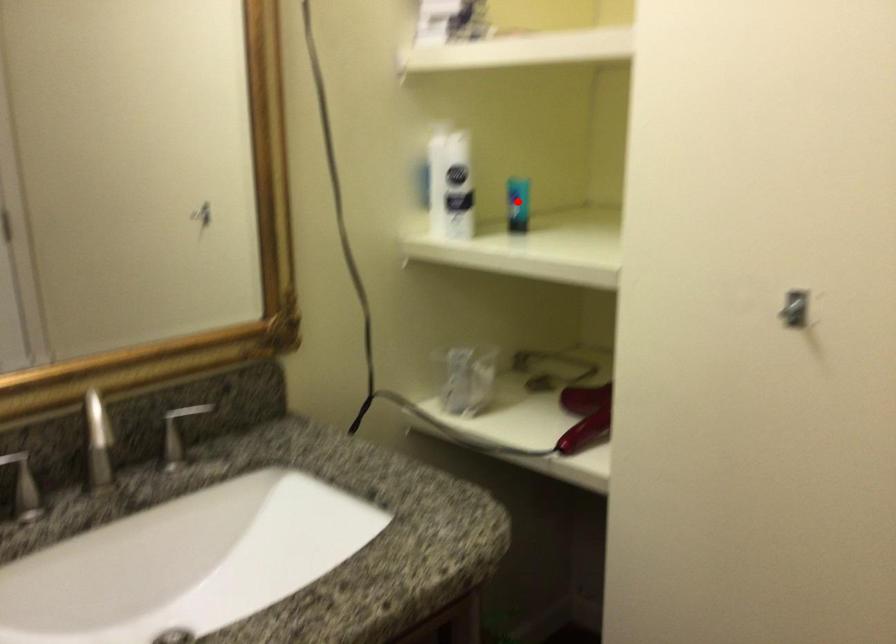
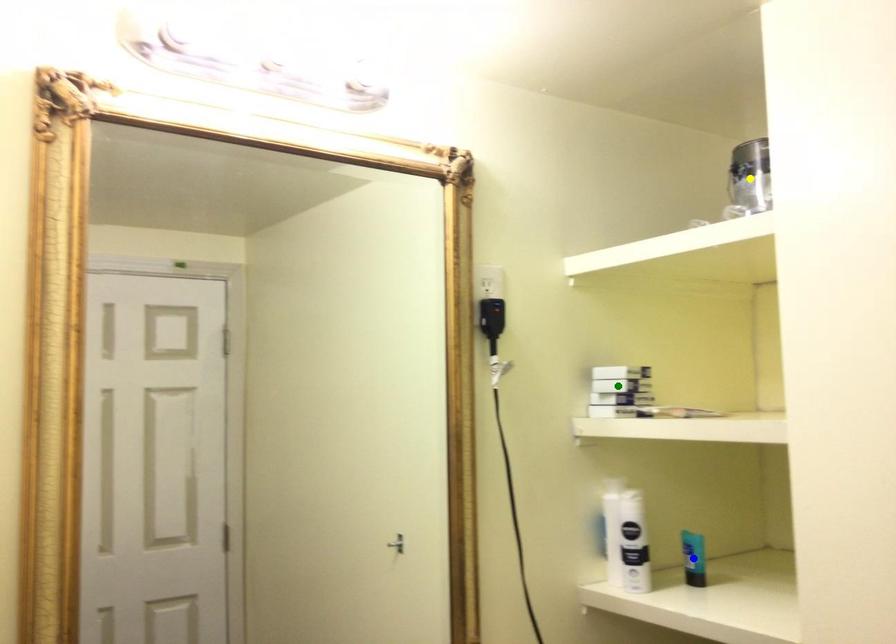
Question: I am providing you with two images of the same scene from different viewpoints. A red point is marked on the first image. You are given multiple points on the second image. Which spot in image 2 lines up with the point in image 1?

Choices:
 (A) yellow point
 (B) green point
 (C) blue point

Answer: (C)